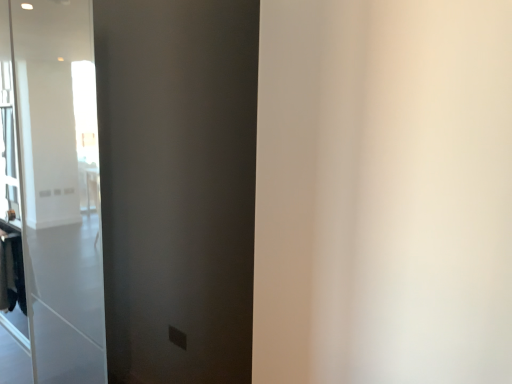
Question: Looking at the image, does matte black barn door at center seem bigger or smaller compared to dark brown fabric laundry at lower left?

Choices:
 (A) big
 (B) small

Answer: (A)

Question: Is matte black barn door at center in front of or behind dark brown fabric laundry at lower left in the image?

Choices:
 (A) behind
 (B) front

Answer: (B)

Question: From a real-world perspective, is matte black barn door at center physically located above or below dark brown fabric laundry at lower left?

Choices:
 (A) above
 (B) below

Answer: (A)

Question: Is dark brown fabric laundry at lower left inside the boundaries of matte black barn door at center, or outside?

Choices:
 (A) outside
 (B) inside

Answer: (A)

Question: Is point (22, 251) positioned closer to the camera than point (154, 276)?

Choices:
 (A) farther
 (B) closer

Answer: (A)

Question: From the image's perspective, is dark brown fabric laundry at lower left located above or below matte black barn door at center?

Choices:
 (A) above
 (B) below

Answer: (B)

Question: From a real-world perspective, is dark brown fabric laundry at lower left positioned above or below matte black barn door at center?

Choices:
 (A) above
 (B) below

Answer: (B)